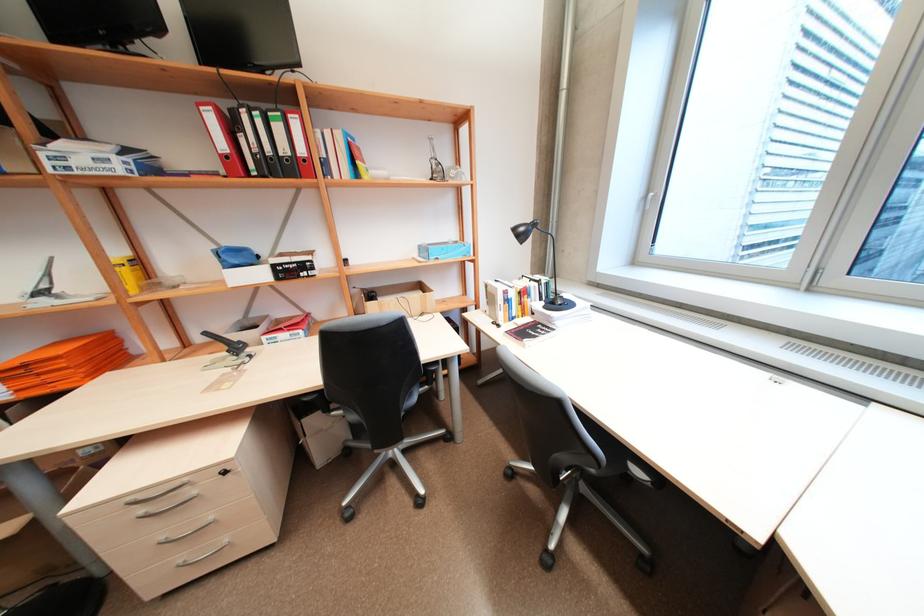
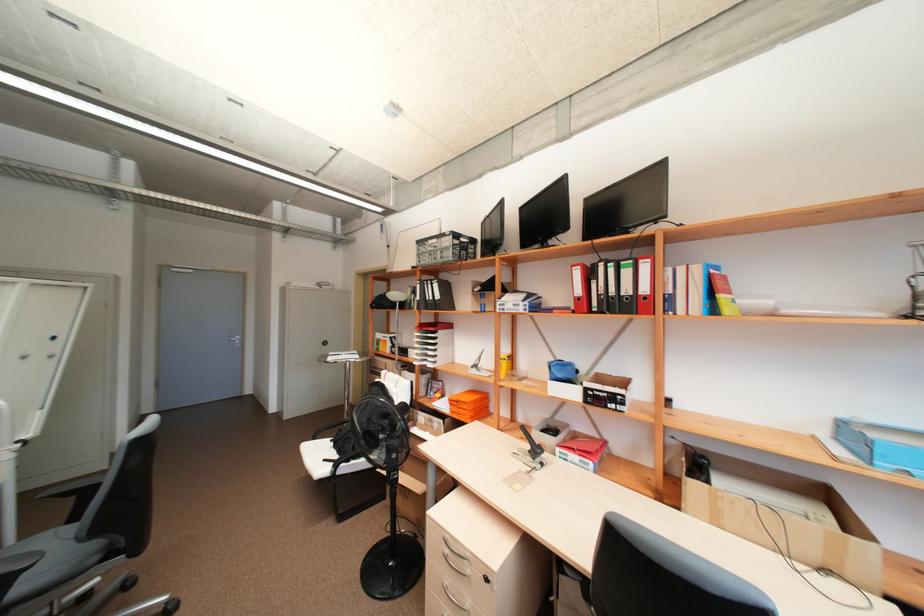
Where in the second image is the point corresponding to [284,128] from the first image?

(633, 273)